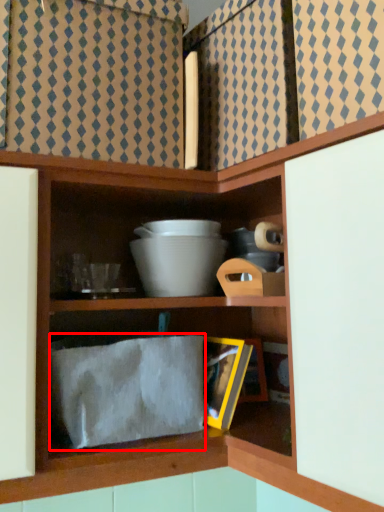
Question: Considering the relative positions of cloth (annotated by the red box) and bowl in the image provided, where is cloth (annotated by the red box) located with respect to the staircase?

Choices:
 (A) right
 (B) left

Answer: (B)